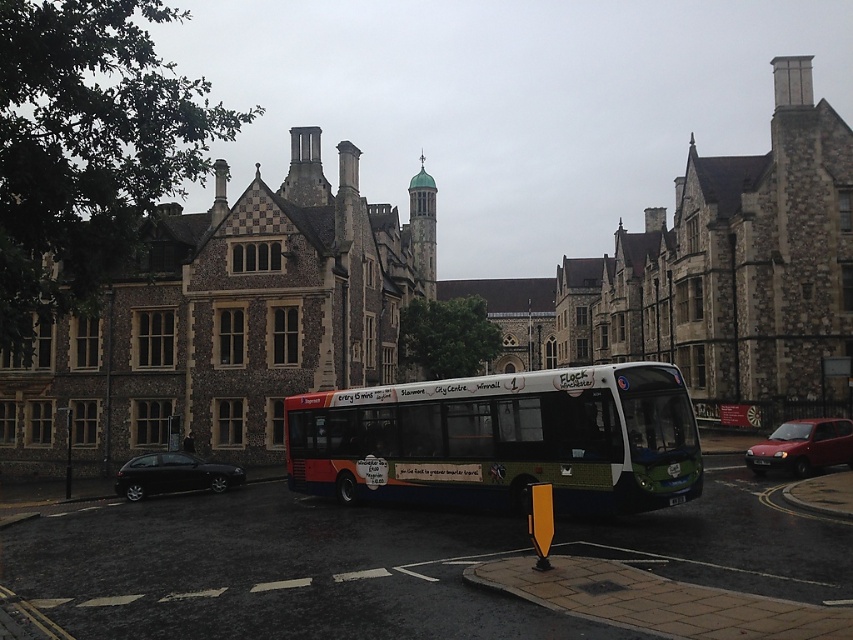
Does green matte bus at center have a larger size compared to shiny red car at lower right?

Yes.

Does green matte bus at center appear under shiny red car at lower right?

No.

I want to click on green matte bus at center, so click(503, 440).

Where is `green matte bus at center`? The width and height of the screenshot is (853, 640). green matte bus at center is located at coordinates (503, 440).

Is shiny red car at lower right closer to camera compared to shiny black hatchback at lower left?

Yes, shiny red car at lower right is in front of shiny black hatchback at lower left.

How far apart are shiny red car at lower right and shiny black hatchback at lower left?

The distance of shiny red car at lower right from shiny black hatchback at lower left is 48.85 meters.

Which is in front, point (844, 424) or point (126, 468)?

Point (844, 424) is more forward.

Find the location of a particular element. Image resolution: width=853 pixels, height=640 pixels. shiny red car at lower right is located at coordinates (802, 445).

Between point (459, 502) and point (125, 481), which one is positioned in front?

Point (459, 502) is more forward.

Which of these two, green matte bus at center or shiny black hatchback at lower left, stands shorter?

shiny black hatchback at lower left is shorter.

Where is `green matte bus at center`? The width and height of the screenshot is (853, 640). green matte bus at center is located at coordinates [x=503, y=440].